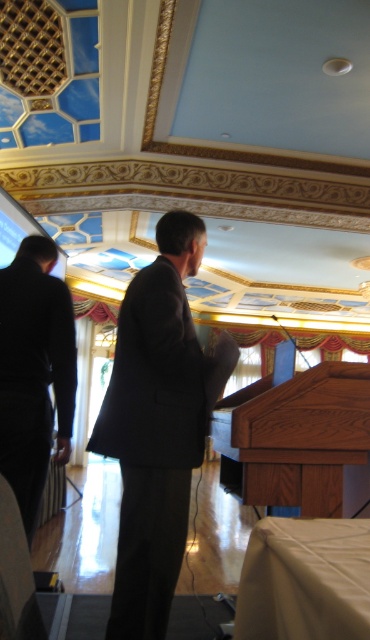
Who is more distant from viewer, (166,250) or (32,332)?

Point (32,332)

Can you confirm if dark gray suit at center is wider than black fabric suit at left?

Yes.

Where is `dark gray suit at center`? The height and width of the screenshot is (640, 370). dark gray suit at center is located at coordinates (157, 426).

Between brown wood podium at center and black fabric suit at left, which one is positioned lower?

brown wood podium at center is below.

Can you confirm if brown wood podium at center is bigger than black fabric suit at left?

Indeed, brown wood podium at center has a larger size compared to black fabric suit at left.

Find the location of a particular element. brown wood podium at center is located at coordinates (294, 436).

Who is positioned more to the right, dark gray suit at center or brown wood podium at center?

brown wood podium at center is more to the right.

Which is above, dark gray suit at center or brown wood podium at center?

dark gray suit at center is higher up.

Between point (152, 401) and point (352, 376), which one is positioned in front?

Positioned in front is point (152, 401).

Where is `dark gray suit at center`? This screenshot has height=640, width=370. dark gray suit at center is located at coordinates (157, 426).